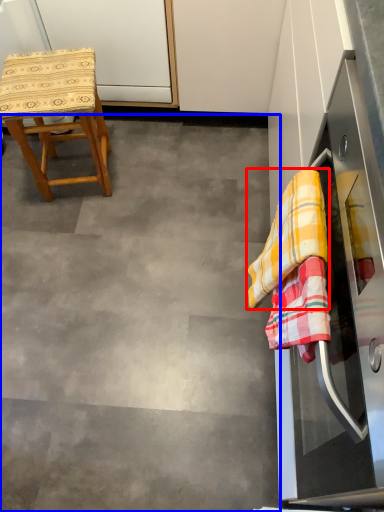
Question: Which point is closer to the camera, clothe (highlighted by a red box) or concrete (highlighted by a blue box)?

Choices:
 (A) clothe
 (B) concrete

Answer: (A)